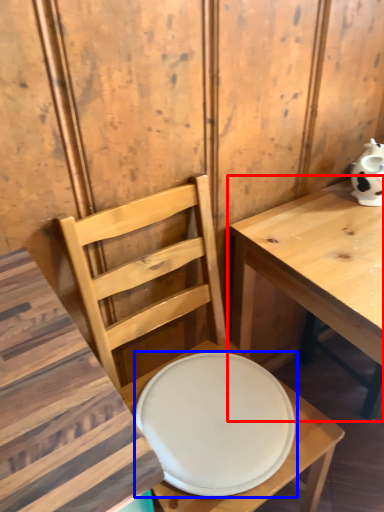
Question: Which of the following is the farthest to the observer, table (highlighted by a red box) or plate (highlighted by a blue box)?

Choices:
 (A) table
 (B) plate

Answer: (B)